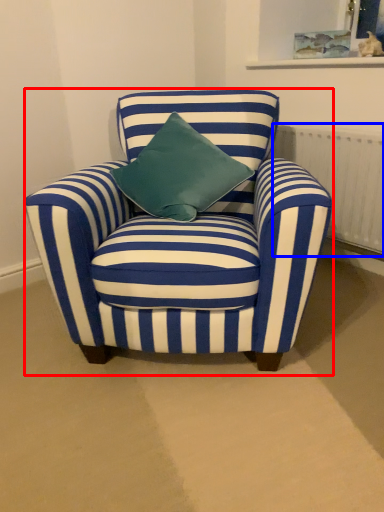
Question: Which of the following is the closest to the observer, chair (highlighted by a red box) or radiator (highlighted by a blue box)?

Choices:
 (A) chair
 (B) radiator

Answer: (A)